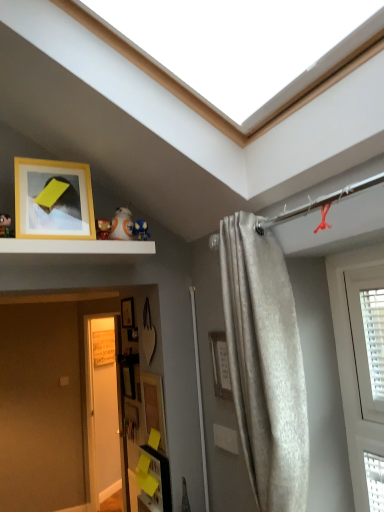
Question: Is wooden picture frame at lower center, the 1th picture frame positioned from the bottom, behind white matte shelf at upper center?

Choices:
 (A) no
 (B) yes

Answer: (B)

Question: Is wooden picture frame at lower center, arranged as the 4th picture frame when viewed from the top, not close to white matte shelf at upper center?

Choices:
 (A) no
 (B) yes

Answer: (B)

Question: Is wooden picture frame at lower center, the third picture frame from the front, positioned beyond the bounds of white matte shelf at upper center?

Choices:
 (A) yes
 (B) no

Answer: (A)

Question: From a real-world perspective, is wooden picture frame at lower center, arranged as the 4th picture frame when viewed from the top, positioned under white matte shelf at upper center based on gravity?

Choices:
 (A) no
 (B) yes

Answer: (B)

Question: Is white matte shelf at upper center completely or partially inside wooden picture frame at lower center, arranged as the 4th picture frame when viewed from the top?

Choices:
 (A) yes
 (B) no

Answer: (B)

Question: Considering the relative positions of wooden picture frame at lower center, which is the 2th picture frame from back to front, and white matte shelf at upper center in the image provided, is wooden picture frame at lower center, which is the 2th picture frame from back to front, to the left of white matte shelf at upper center from the viewer's perspective?

Choices:
 (A) no
 (B) yes

Answer: (B)

Question: Is wooden picture frame at lower center, arranged as the 4th picture frame when viewed from the top, looking in the opposite direction of matte wooden picture frame at lower center, the 3th picture frame viewed from the top?

Choices:
 (A) no
 (B) yes

Answer: (A)

Question: Does wooden picture frame at lower center, the third picture frame from the front, lie behind matte wooden picture frame at lower center, acting as the 3th picture frame starting from the back?

Choices:
 (A) no
 (B) yes

Answer: (B)

Question: Is wooden picture frame at lower center, the 1th picture frame positioned from the bottom, wider than matte wooden picture frame at lower center, the 3th picture frame viewed from the top?

Choices:
 (A) yes
 (B) no

Answer: (A)

Question: Is matte wooden picture frame at lower center, the 2th picture frame viewed from the front, inside wooden picture frame at lower center, the third picture frame from the front?

Choices:
 (A) yes
 (B) no

Answer: (B)

Question: Does wooden picture frame at lower center, which is the 2th picture frame from back to front, have a lesser height compared to matte wooden picture frame at lower center, which is the 2th picture frame in bottom-to-top order?

Choices:
 (A) no
 (B) yes

Answer: (B)

Question: Is wooden picture frame at lower center, arranged as the 4th picture frame when viewed from the top, positioned beyond the bounds of matte wooden picture frame at lower center, acting as the 3th picture frame starting from the back?

Choices:
 (A) yes
 (B) no

Answer: (A)

Question: Is wooden picture frame at lower center, arranged as the 4th picture frame when viewed from the top, at the back of wooden picture frame at center, which appears as the 1th picture frame when viewed from the back?

Choices:
 (A) no
 (B) yes

Answer: (A)